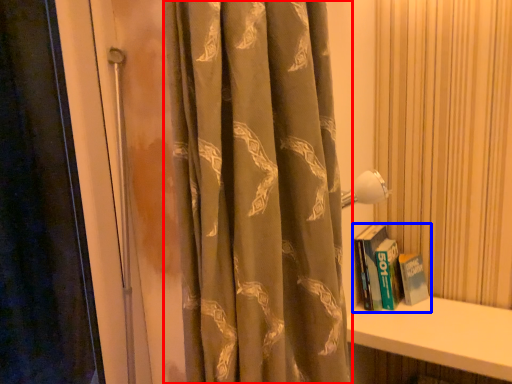
Question: Among these objects, which one is nearest to the camera, curtain (highlighted by a red box) or book (highlighted by a blue box)?

Choices:
 (A) curtain
 (B) book

Answer: (A)